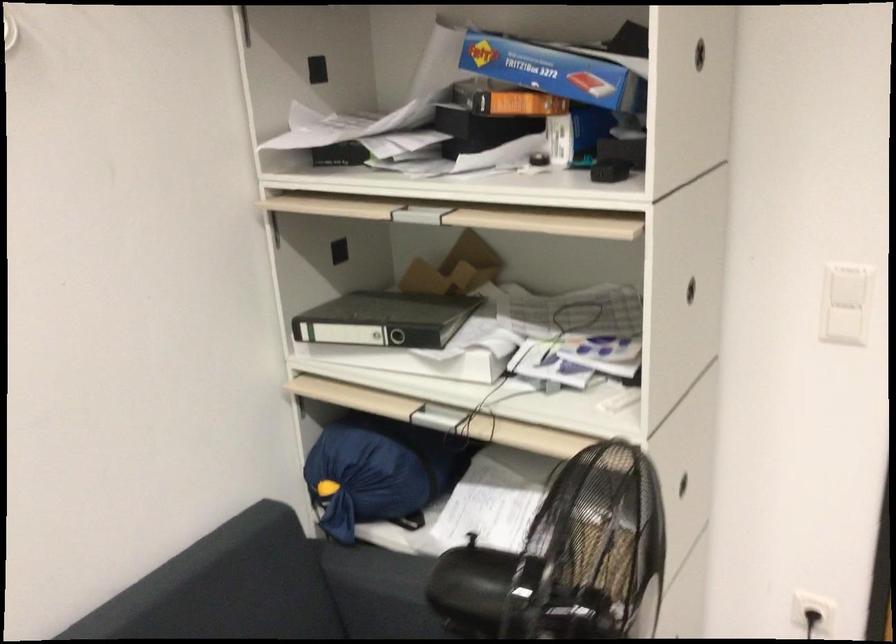
At what (x,y) coordinates should I click in order to perform the action: click on white light switch. Please return your answer as a coordinate pair (x, y). Looking at the image, I should click on 843,326.